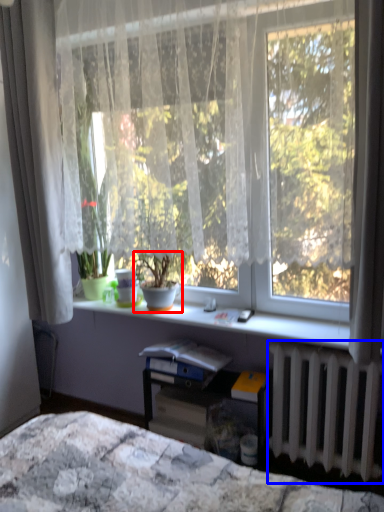
Question: Among these objects, which one is nearest to the camera, houseplant (highlighted by a red box) or radiator (highlighted by a blue box)?

Choices:
 (A) houseplant
 (B) radiator

Answer: (B)